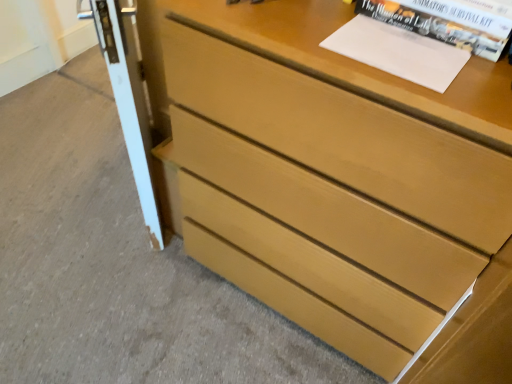
Question: Does light brown wood chest of drawers at center have a larger size compared to white paper at upper right?

Choices:
 (A) yes
 (B) no

Answer: (A)

Question: From a real-world perspective, does light brown wood chest of drawers at center stand above white paper at upper right?

Choices:
 (A) no
 (B) yes

Answer: (A)

Question: Can you confirm if light brown wood chest of drawers at center is wider than white paper at upper right?

Choices:
 (A) no
 (B) yes

Answer: (B)

Question: Is the position of light brown wood chest of drawers at center more distant than that of white paper at upper right?

Choices:
 (A) no
 (B) yes

Answer: (A)

Question: Is light brown wood chest of drawers at center positioned beyond the bounds of white paper at upper right?

Choices:
 (A) no
 (B) yes

Answer: (B)

Question: From their relative heights in the image, would you say white glossy screen door at left is taller or shorter than white paper at upper right?

Choices:
 (A) tall
 (B) short

Answer: (A)

Question: From a real-world perspective, relative to white paper at upper right, is white glossy screen door at left vertically above or below?

Choices:
 (A) below
 (B) above

Answer: (A)

Question: Is white glossy screen door at left to the left or to the right of white paper at upper right in the image?

Choices:
 (A) right
 (B) left

Answer: (B)

Question: Is white glossy screen door at left wider or thinner than white paper at upper right?

Choices:
 (A) thin
 (B) wide

Answer: (A)

Question: Is white paper at upper right spatially inside light brown wood chest of drawers at center, or outside of it?

Choices:
 (A) inside
 (B) outside

Answer: (B)

Question: In the image, is white paper at upper right on the left side or the right side of light brown wood chest of drawers at center?

Choices:
 (A) left
 (B) right

Answer: (B)

Question: Relative to light brown wood chest of drawers at center, is white paper at upper right in front or behind?

Choices:
 (A) front
 (B) behind

Answer: (B)

Question: From a real-world perspective, is white paper at upper right above or below light brown wood chest of drawers at center?

Choices:
 (A) above
 (B) below

Answer: (A)

Question: Considering the positions of point (144, 215) and point (228, 218), is point (144, 215) closer or farther from the camera than point (228, 218)?

Choices:
 (A) farther
 (B) closer

Answer: (A)

Question: Is white glossy screen door at left in front of or behind light brown wood chest of drawers at center in the image?

Choices:
 (A) behind
 (B) front

Answer: (A)